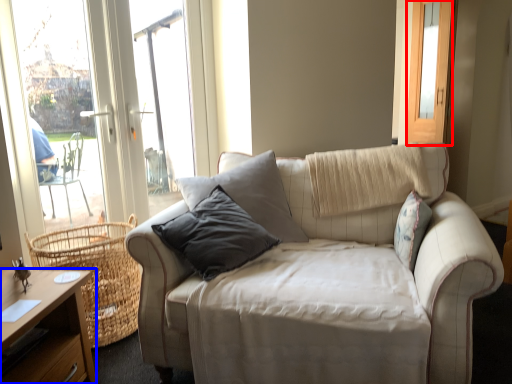
Question: Which point is further to the camera, screen door (highlighted by a red box) or desk (highlighted by a blue box)?

Choices:
 (A) screen door
 (B) desk

Answer: (A)